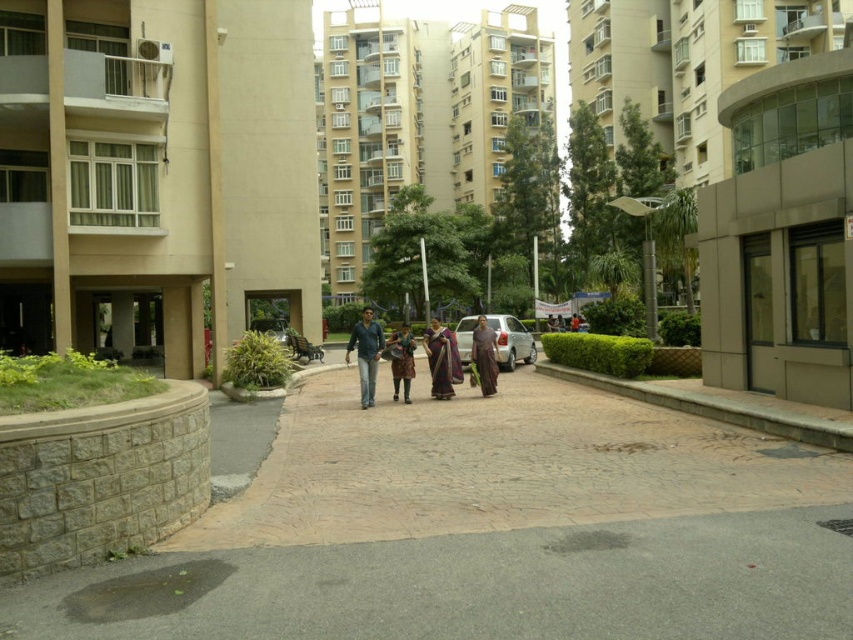
You are a delivery person trying to navigate through the residential area. You need to deliver a package to the beige concrete building at center. There is a brown fabric saree at center blocking your path. Can you pass through? Explain why.

The beige concrete building at center is larger in size than the brown fabric saree at center. Since the saree is likely part of a person, it is much smaller than the building, so you can easily pass around or through the area where the brown fabric saree at center is located to reach the beige concrete building at center.

You are a delivery person trying to park your delivery van, which is 2 meters wide, in the residential area. You see a satin silver car at center and brown fabric pants at center. Can you determine if there is enough space between them to park your van?

The satin silver car at center is wider than the brown fabric pants at center. However, the exact distance between them isn